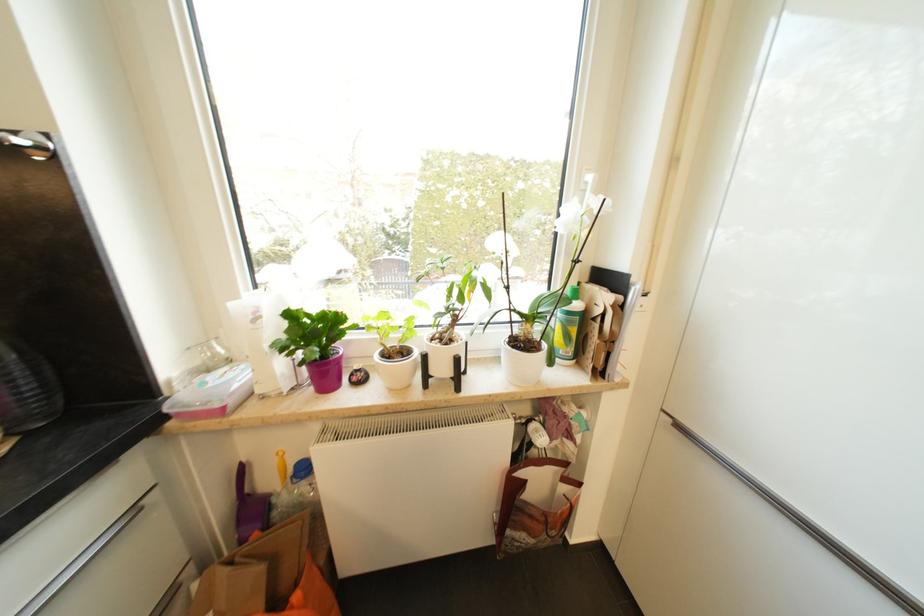
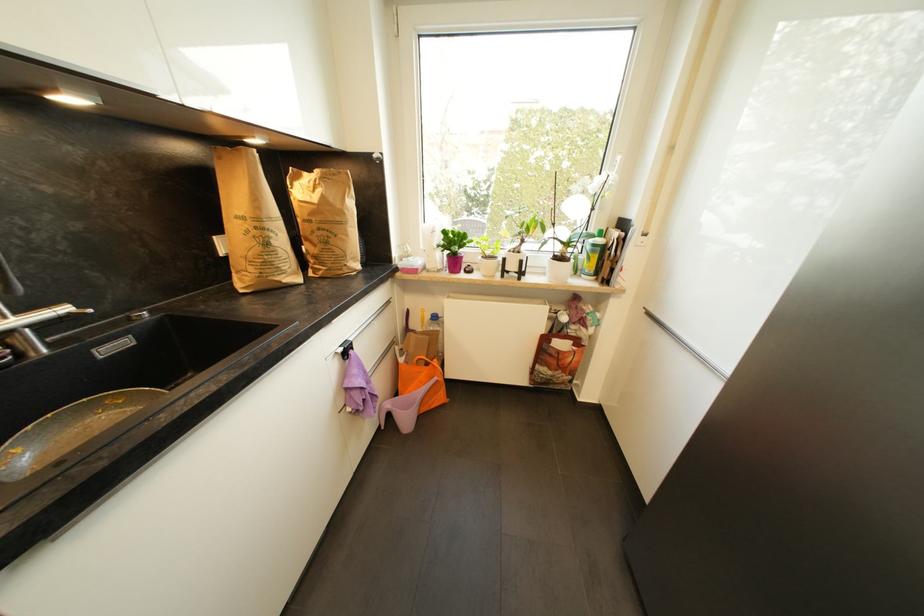
In the second image, find the point that corresponds to (x=537, y=543) in the first image.

(554, 375)